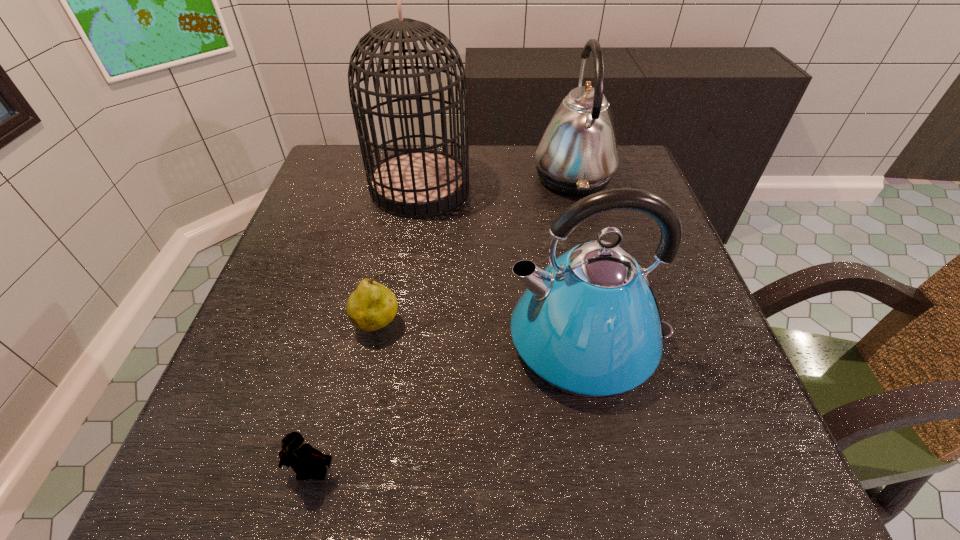
Image resolution: width=960 pixels, height=540 pixels. Identify the location of object at the near left corner. (304, 459).

Identify the location of object present at the far right corner. (577, 154).

In the image, there is a desktop. At what (x,y) coordinates should I click in order to perform the action: click on vacant space at the far edge. Please return your answer as a coordinate pair (x, y). The width and height of the screenshot is (960, 540). Looking at the image, I should click on (530, 193).

Locate an element on the screen. This screenshot has width=960, height=540. free space at the near edge is located at coordinates (582, 477).

Where is `vacant point at the left edge`? vacant point at the left edge is located at coordinates (352, 275).

The image size is (960, 540). In the image, there is a desktop. Find the location of `vacant region at the right edge`. vacant region at the right edge is located at coordinates (671, 323).

Find the location of a particular element. This screenshot has height=540, width=960. free space at the far left corner of the desktop is located at coordinates (362, 185).

Locate an element on the screen. free space at the near left corner of the desktop is located at coordinates point(216,447).

Find the location of a particular element. This screenshot has height=540, width=960. vacant space at the far right corner is located at coordinates (618, 152).

Locate an element on the screen. The image size is (960, 540). free space at the near right corner of the desktop is located at coordinates (688, 458).